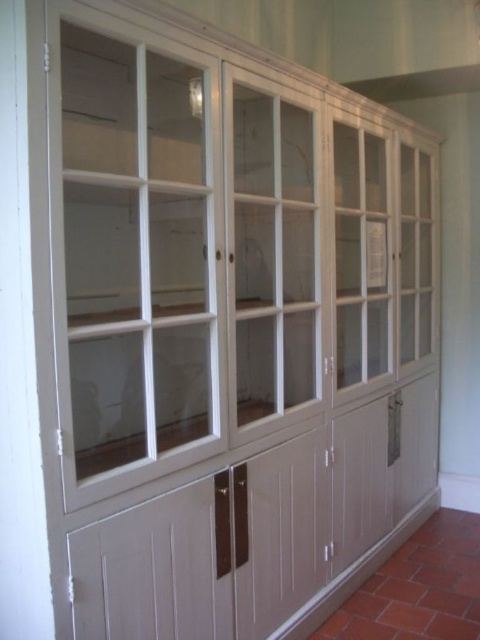
You are an interior designer planning to move the clear glass cabinet at left and the clear glass cabinet at center closer together. Which cabinet should you move first to minimize the space needed between them?

The clear glass cabinet at left is wider than the clear glass cabinet at center, so you should move the clear glass cabinet at left first to minimize the space needed between them.

You are standing in the room and want to place a small potted plant on the clear glass cabinet at left. Where exactly should you place it?

You should place the small potted plant at point (132, 252) on the clear glass cabinet at left.